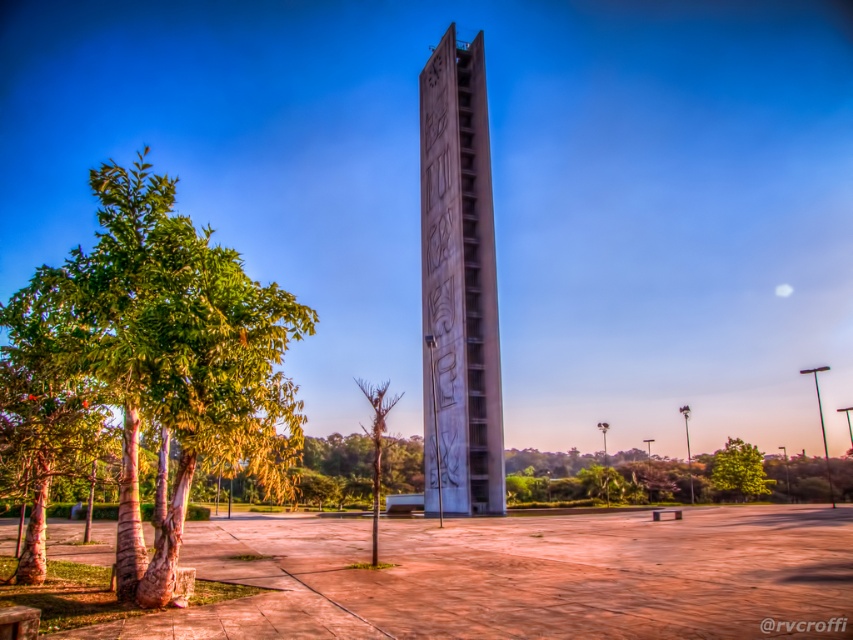
Describe the element at coordinates (740, 468) in the screenshot. I see `green leafy tree at center` at that location.

Who is more forward, (751, 490) or (375, 413)?

Point (375, 413) is in front.

Where is `green leafy tree at center`? This screenshot has height=640, width=853. green leafy tree at center is located at coordinates (740, 468).

Is white concrete tower at center below green leafy tree at center?

No.

What do you see at coordinates (459, 284) in the screenshot? I see `white concrete tower at center` at bounding box center [459, 284].

The height and width of the screenshot is (640, 853). What are the coordinates of `white concrete tower at center` in the screenshot? It's located at (459, 284).

Is white concrete tower at center above bare wood tree at center?

Indeed, white concrete tower at center is positioned over bare wood tree at center.

Is white concrete tower at center behind bare wood tree at center?

Yes, white concrete tower at center is further from the viewer.

Where is `white concrete tower at center`? The image size is (853, 640). white concrete tower at center is located at coordinates (459, 284).